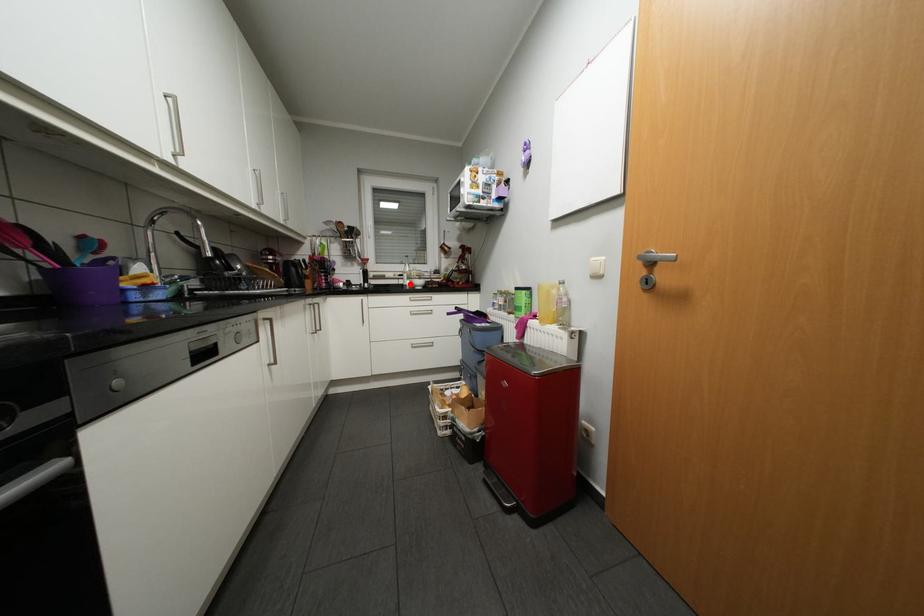
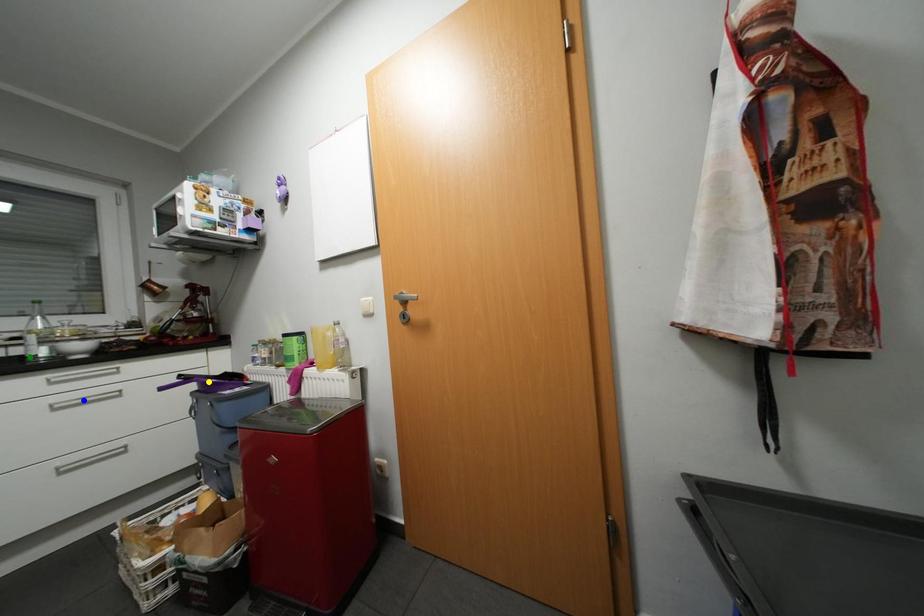
Question: I am providing you with two images of the same scene from different viewpoints. A red point is marked on the first image. You are given multiple points on the second image. Which mark in image 2 goes with the point in image 1?

Choices:
 (A) yellow point
 (B) green point
 (C) blue point

Answer: (B)